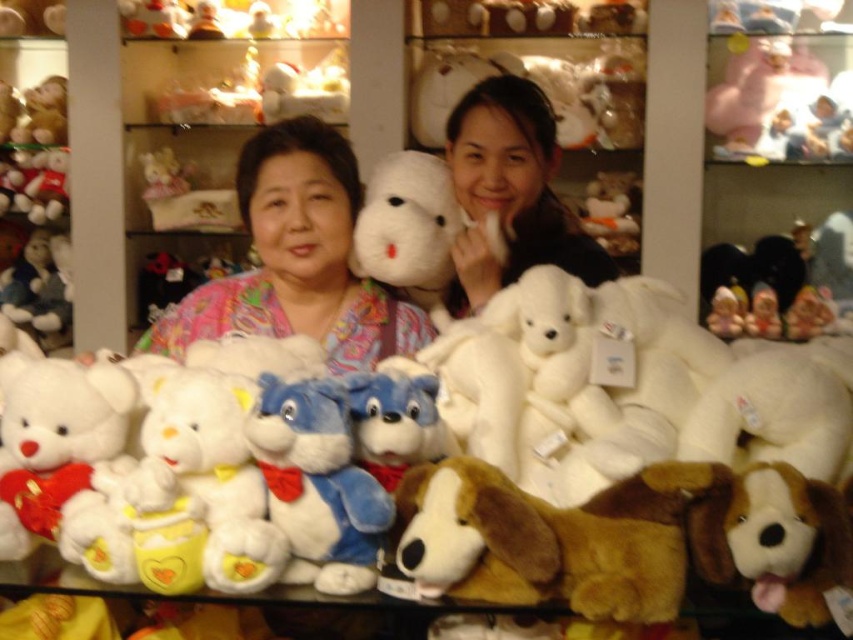
Looking at this image, which is below, matte white teddy bear at upper center or fluffy white teddy bear at upper left?

matte white teddy bear at upper center is below.

Could you measure the distance between matte white teddy bear at upper center and fluffy white teddy bear at upper left?

matte white teddy bear at upper center is 1.47 meters from fluffy white teddy bear at upper left.

Find the location of a particular element. matte white teddy bear at upper center is located at coordinates (509, 193).

You are a GUI agent. You are given a task and a screenshot of the screen. Output one action in this format:
    pyautogui.click(x=<x>, y=<y>)
    Task: Click on the matte white teddy bear at upper center
    The height and width of the screenshot is (640, 853).
    Given the screenshot: What is the action you would take?
    pyautogui.click(x=509, y=193)

Is matte pink blouse at center to the left of white plush bear at upper center from the viewer's perspective?

In fact, matte pink blouse at center is to the right of white plush bear at upper center.

What do you see at coordinates (297, 259) in the screenshot? I see `matte pink blouse at center` at bounding box center [297, 259].

Where is `matte pink blouse at center`? This screenshot has width=853, height=640. matte pink blouse at center is located at coordinates (297, 259).

Between matte pink blouse at center and fluffy white teddy bear at upper left, which one has more height?

Standing taller between the two is matte pink blouse at center.

Who is more distant from viewer, (274, 305) or (184, 173)?

The point (184, 173) is more distant.

This screenshot has height=640, width=853. What do you see at coordinates (297, 259) in the screenshot? I see `matte pink blouse at center` at bounding box center [297, 259].

Where is `matte pink blouse at center`? matte pink blouse at center is located at coordinates (297, 259).